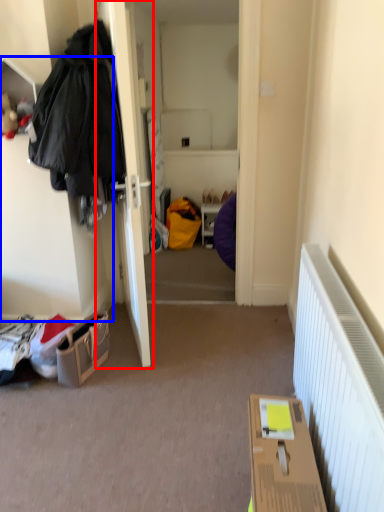
Question: Among these objects, which one is farthest to the camera, door (highlighted by a red box) or cabinetry (highlighted by a blue box)?

Choices:
 (A) door
 (B) cabinetry

Answer: (A)